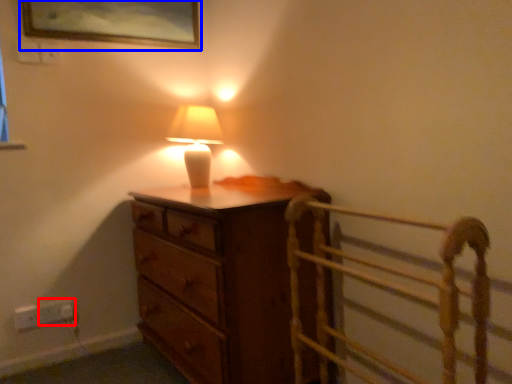
Question: Which point is further to the camera, electric outlet (highlighted by a red box) or picture frame (highlighted by a blue box)?

Choices:
 (A) electric outlet
 (B) picture frame

Answer: (A)